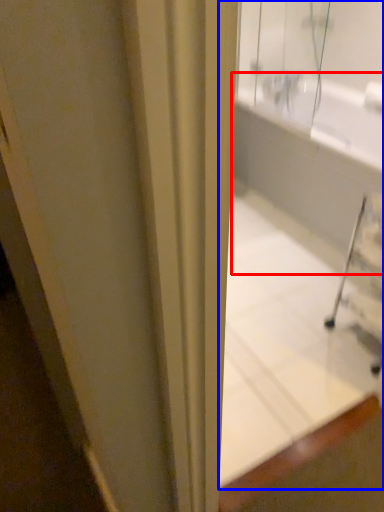
Question: Which of the following is the closest to the observer, bath (highlighted by a red box) or bathtub (highlighted by a blue box)?

Choices:
 (A) bath
 (B) bathtub

Answer: (B)